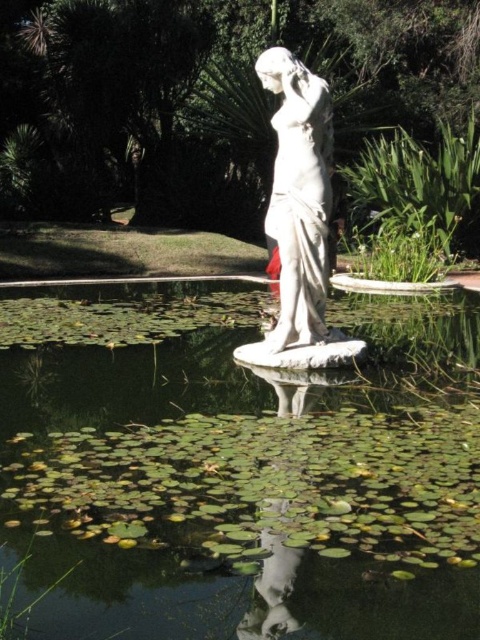
You are a gardener planning to place a decorative stone at the exact center of the pond. Given the green lily pads at center are positioned at coordinates point 0.733, 0.494, can you determine if the lily pads are closer to the edge or the center of the pond?

The green lily pads at center are located at point [237,468], which means they are closer to the edge of the pond since their coordinates are not at the exact center point of the pond.

You are a gardener who wants to place a new decorative item in the garden. You have a small golden bird statue that you want to position near the white marble statue at center and the green lily pads at center. Based on their current positions, where should you place the golden bird statue so that it is between the two objects?

The green lily pads at center are located below the white marble statue at center. To place the golden bird statue between them, position it between the white marble statue at center and the green lily pads at center, ensuring it is above the lily pads and below the statue.

You are a gardener who wants to place a new decorative fountain in the garden. The fountain is 1.2 meters tall. You see the green lily pads at center and the white marble statue at center. Can you place the fountain next to the statue without it being taller than the statue?

The green lily pads at center is not as tall as white marble statue at center, meaning the statue is taller. Since the fountain is 1.2 meters tall, if the statue is taller than 1.2 meters, the fountain can be placed next to it without exceeding its height. However, if the statue is shorter, it won